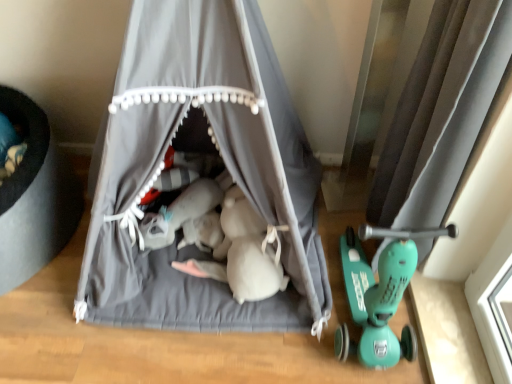
The width and height of the screenshot is (512, 384). What do you see at coordinates (224, 163) in the screenshot? I see `gray fabric tent at center, which is the first curtain in left-to-right order` at bounding box center [224, 163].

Locate an element on the screen. The height and width of the screenshot is (384, 512). gray fabric tent at center, which ranks as the 2th curtain in right-to-left order is located at coordinates (224, 163).

The image size is (512, 384). What are the coordinates of `silky gray curtain at right, positioned as the first curtain in right-to-left order` in the screenshot? It's located at (441, 112).

Describe the element at coordinates (441, 112) in the screenshot. The image size is (512, 384). I see `silky gray curtain at right, acting as the 2th curtain starting from the left` at that location.

In order to face silky gray curtain at right, positioned as the first curtain in right-to-left order, should I rotate leftwards or rightwards?

To align with it, rotate right about 20.358°.

Identify the location of gray fabric tent at center, which is the first curtain in left-to-right order. (224, 163).

Does gray fabric tent at center, which is the first curtain in left-to-right order, appear on the left side of silky gray curtain at right, positioned as the first curtain in right-to-left order?

Indeed, gray fabric tent at center, which is the first curtain in left-to-right order, is positioned on the left side of silky gray curtain at right, positioned as the first curtain in right-to-left order.

Between gray fabric tent at center, which is the first curtain in left-to-right order, and silky gray curtain at right, positioned as the first curtain in right-to-left order, which one is positioned behind?

silky gray curtain at right, positioned as the first curtain in right-to-left order, is further from the camera.

Considering the points (139, 154) and (444, 172), which point is in front, point (139, 154) or point (444, 172)?

The point (139, 154) is more forward.

From the image's perspective, does gray fabric tent at center, which is the first curtain in left-to-right order, appear lower than silky gray curtain at right, acting as the 2th curtain starting from the left?

No, from the image's perspective, gray fabric tent at center, which is the first curtain in left-to-right order, is not below silky gray curtain at right, acting as the 2th curtain starting from the left.

Based on the photo, from a real-world perspective, does gray fabric tent at center, which ranks as the 2th curtain in right-to-left order, sit lower than silky gray curtain at right, positioned as the first curtain in right-to-left order?

No, from a real-world perspective, gray fabric tent at center, which ranks as the 2th curtain in right-to-left order, is not beneath silky gray curtain at right, positioned as the first curtain in right-to-left order.

Based on the photo, does gray fabric tent at center, which is the first curtain in left-to-right order, have a lesser width compared to silky gray curtain at right, positioned as the first curtain in right-to-left order?

No, gray fabric tent at center, which is the first curtain in left-to-right order, is not thinner than silky gray curtain at right, positioned as the first curtain in right-to-left order.

Can you confirm if gray fabric tent at center, which ranks as the 2th curtain in right-to-left order, is taller than silky gray curtain at right, positioned as the first curtain in right-to-left order?

Yes, gray fabric tent at center, which ranks as the 2th curtain in right-to-left order, is taller than silky gray curtain at right, positioned as the first curtain in right-to-left order.

Considering the relative sizes of gray fabric tent at center, which ranks as the 2th curtain in right-to-left order, and silky gray curtain at right, positioned as the first curtain in right-to-left order, in the image provided, is gray fabric tent at center, which ranks as the 2th curtain in right-to-left order, bigger than silky gray curtain at right, positioned as the first curtain in right-to-left order,?

Yes.

Can we say gray fabric tent at center, which ranks as the 2th curtain in right-to-left order, lies outside silky gray curtain at right, acting as the 2th curtain starting from the left?

Yes, gray fabric tent at center, which ranks as the 2th curtain in right-to-left order, is located beyond the bounds of silky gray curtain at right, acting as the 2th curtain starting from the left.

Is gray fabric tent at center, which ranks as the 2th curtain in right-to-left order, far away from silky gray curtain at right, positioned as the first curtain in right-to-left order?

They are positioned close to each other.

From the picture: Could you tell me if gray fabric tent at center, which ranks as the 2th curtain in right-to-left order, is facing silky gray curtain at right, positioned as the first curtain in right-to-left order?

No, gray fabric tent at center, which ranks as the 2th curtain in right-to-left order, is not aimed at silky gray curtain at right, positioned as the first curtain in right-to-left order.

How different are the orientations of gray fabric tent at center, which ranks as the 2th curtain in right-to-left order, and silky gray curtain at right, positioned as the first curtain in right-to-left order, in degrees?

87.9 degrees separate the facing orientations of gray fabric tent at center, which ranks as the 2th curtain in right-to-left order, and silky gray curtain at right, positioned as the first curtain in right-to-left order.

Identify the location of curtain on the left of silky gray curtain at right, acting as the 2th curtain starting from the left. Image resolution: width=512 pixels, height=384 pixels. (224, 163).

Based on their positions, is silky gray curtain at right, acting as the 2th curtain starting from the left, located to the left or right of gray fabric tent at center, which is the first curtain in left-to-right order?

silky gray curtain at right, acting as the 2th curtain starting from the left, is positioned on gray fabric tent at center, which is the first curtain in left-to-right order,'s right side.

Looking at this image, which object is further away from the camera taking this photo, silky gray curtain at right, acting as the 2th curtain starting from the left, or gray fabric tent at center, which ranks as the 2th curtain in right-to-left order?

silky gray curtain at right, acting as the 2th curtain starting from the left, is further from the camera.

Is point (454, 43) positioned after point (225, 56)?

No, (454, 43) is closer to viewer.

In the scene shown: From the image's perspective, which one is positioned lower, silky gray curtain at right, acting as the 2th curtain starting from the left, or gray fabric tent at center, which is the first curtain in left-to-right order?

silky gray curtain at right, acting as the 2th curtain starting from the left, is shown below in the image.

Looking at this image, from a real-world perspective, between silky gray curtain at right, acting as the 2th curtain starting from the left, and gray fabric tent at center, which ranks as the 2th curtain in right-to-left order, who is vertically lower?

silky gray curtain at right, acting as the 2th curtain starting from the left.

Is silky gray curtain at right, positioned as the first curtain in right-to-left order, wider than gray fabric tent at center, which ranks as the 2th curtain in right-to-left order?

Incorrect, the width of silky gray curtain at right, positioned as the first curtain in right-to-left order, does not surpass that of gray fabric tent at center, which ranks as the 2th curtain in right-to-left order.

In the scene shown: Which of these two, silky gray curtain at right, positioned as the first curtain in right-to-left order, or gray fabric tent at center, which is the first curtain in left-to-right order, stands taller?

gray fabric tent at center, which is the first curtain in left-to-right order, is taller.

Between silky gray curtain at right, acting as the 2th curtain starting from the left, and gray fabric tent at center, which ranks as the 2th curtain in right-to-left order, which one has larger size?

gray fabric tent at center, which ranks as the 2th curtain in right-to-left order.

Can we say silky gray curtain at right, positioned as the first curtain in right-to-left order, lies outside gray fabric tent at center, which ranks as the 2th curtain in right-to-left order?

Yes, silky gray curtain at right, positioned as the first curtain in right-to-left order, is not within gray fabric tent at center, which ranks as the 2th curtain in right-to-left order.

Is silky gray curtain at right, acting as the 2th curtain starting from the left, not close to gray fabric tent at center, which ranks as the 2th curtain in right-to-left order?

That's not correct — silky gray curtain at right, acting as the 2th curtain starting from the left, is a little close to gray fabric tent at center, which ranks as the 2th curtain in right-to-left order.

Could you tell me if silky gray curtain at right, positioned as the first curtain in right-to-left order, is facing gray fabric tent at center, which is the first curtain in left-to-right order?

Yes, silky gray curtain at right, positioned as the first curtain in right-to-left order, is oriented towards gray fabric tent at center, which is the first curtain in left-to-right order.

How different are the orientations of silky gray curtain at right, acting as the 2th curtain starting from the left, and gray fabric tent at center, which is the first curtain in left-to-right order, in degrees?

silky gray curtain at right, acting as the 2th curtain starting from the left, and gray fabric tent at center, which is the first curtain in left-to-right order, are facing 87.9 degrees away from each other.

I want to click on curtain lying above the silky gray curtain at right, positioned as the first curtain in right-to-left order (from the image's perspective), so click(224, 163).

In the image, there is a gray fabric tent at center, which is the first curtain in left-to-right order. At what (x,y) coordinates should I click in order to perform the action: click on curtain below it (from a real-world perspective). Please return your answer as a coordinate pair (x, y). The image size is (512, 384). Looking at the image, I should click on (441, 112).

You are a GUI agent. You are given a task and a screenshot of the screen. Output one action in this format:
    pyautogui.click(x=<x>, y=<y>)
    Task: Click on the curtain on the left of the silky gray curtain at right, positioned as the first curtain in right-to-left order
    
    Given the screenshot: What is the action you would take?
    pyautogui.click(x=224, y=163)